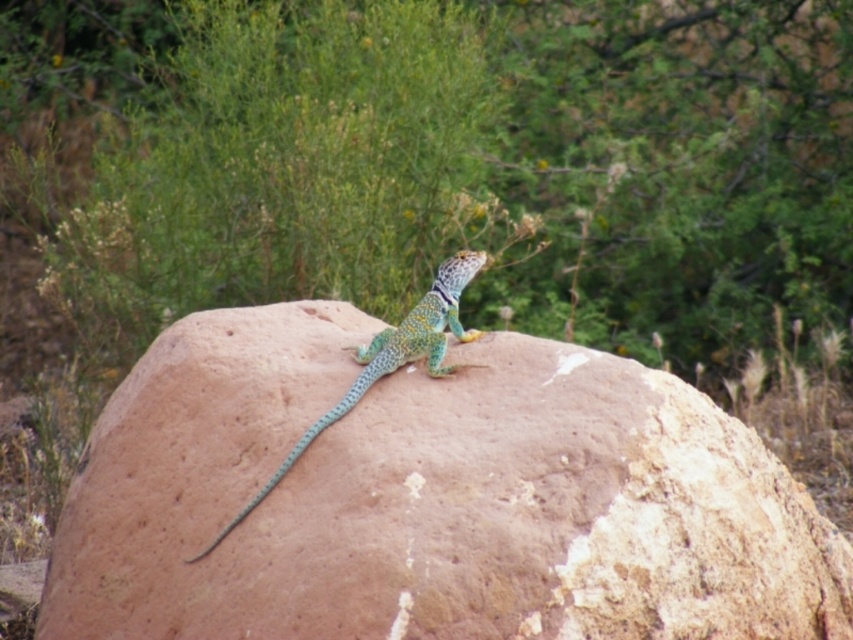
You are a photographer trying to capture the shiny green scales lizard at center and the green scaly tail at center in a single frame. Given that your camera has a minimum focus distance of 3 inches, will you be able to focus on both subjects clearly?

The shiny green scales lizard at center and the green scaly tail at center are 2.77 inches apart from each other. Since the distance between them is less than the camera minimum focus distance of 3 inches, the camera may not be able to focus on both subjects clearly.

You are a photographer trying to capture the lizard and its surroundings. You notice the smooth brown rock at center and the green scaly tail at center. Which object is positioned lower in the image?

The smooth brown rock at center is located below the green scaly tail at center, so it is positioned lower in the image.